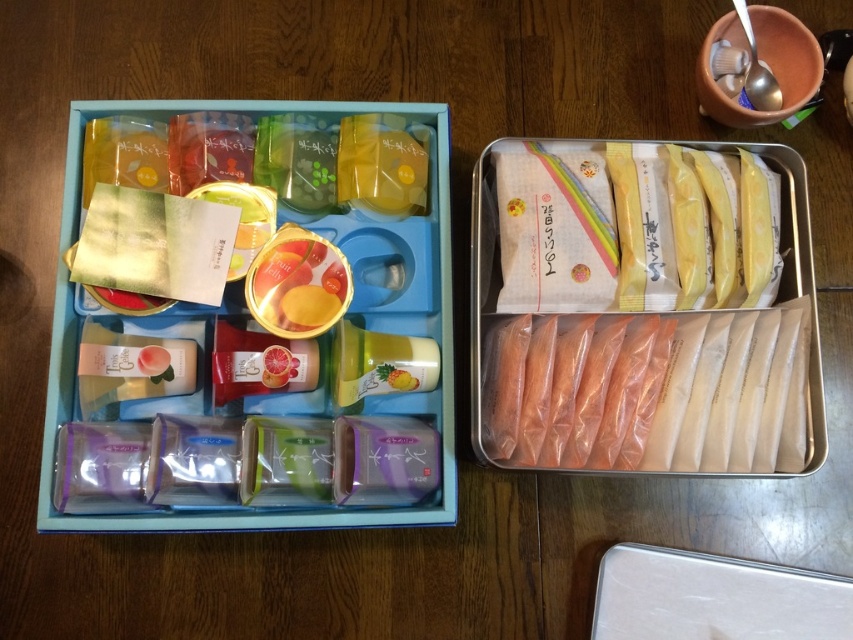
You need to pack a lunch for a picnic and have both the matte plastic lunch box at center and the golden glossy jar at center available. Which container can hold more food?

The matte plastic lunch box at center has a larger size compared to the golden glossy jar at center, so it can hold more food.